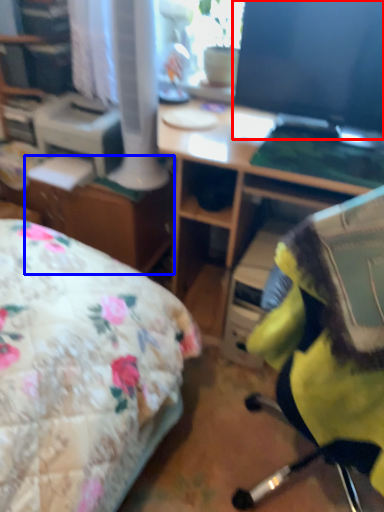
Question: Among these objects, which one is farthest to the camera, computer monitor (highlighted by a red box) or file cabinet (highlighted by a blue box)?

Choices:
 (A) computer monitor
 (B) file cabinet

Answer: (B)